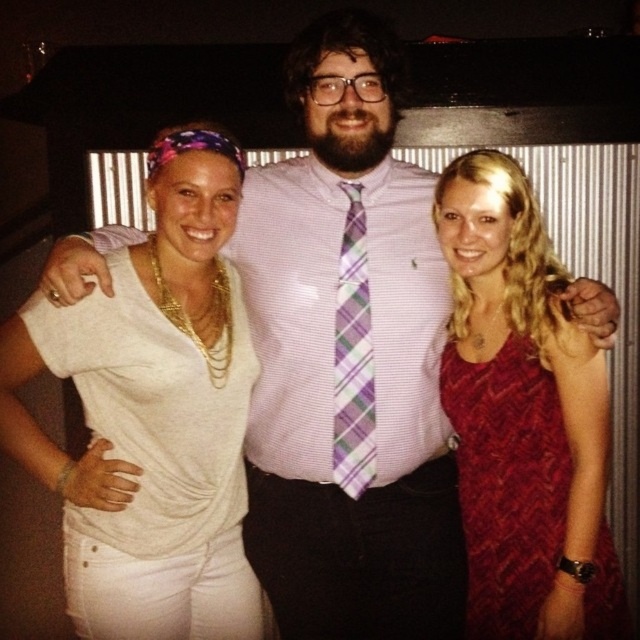
You are a photographer adjusting the focus on your camera. You want to ensure that both the white matte shirt at center and the plaid fabric tie at center are in sharp focus. Which object should you focus on first to achieve this?

You should focus on the white matte shirt at center first because it is closer to the viewer than the plaid fabric tie at center. By focusing on the closer object, the farther one may still be within the depth of field, ensuring both are sharp.

You are a photographer trying to adjust the lighting for a photo shoot. You notice the white matte shirt at center and the plaid fabric tie at center. Which item is located lower in the image?

The white matte shirt at center is positioned under the plaid fabric tie at center, so the white matte shirt at center is lower in the image.